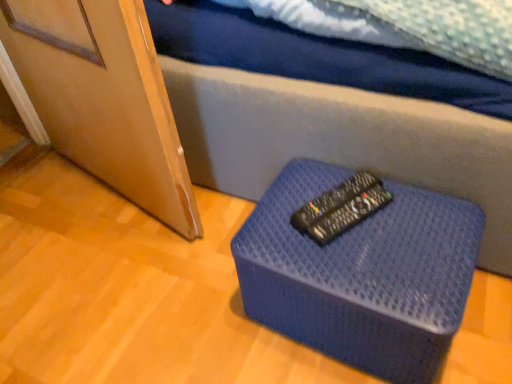
Locate an element on the screen. The width and height of the screenshot is (512, 384). vacant area that lies to the right of black plastic remote at center is located at coordinates (423, 210).